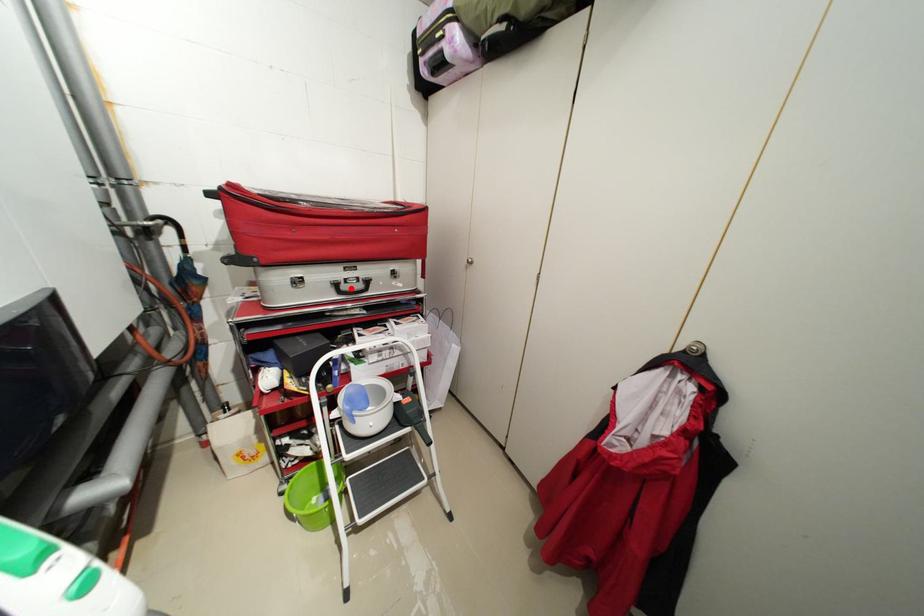
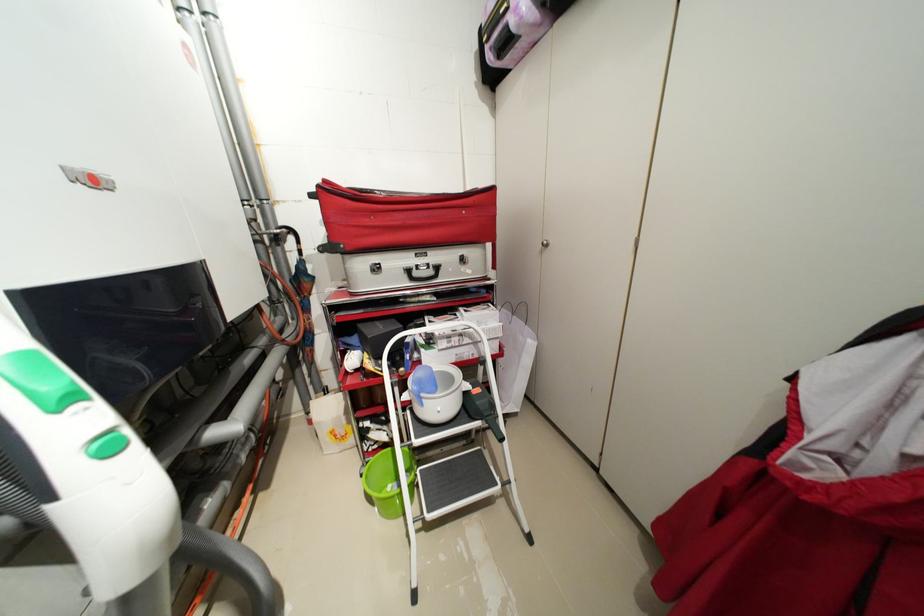
In the second image, find the point that corresponds to the highlighted location in the first image.

(422, 275)